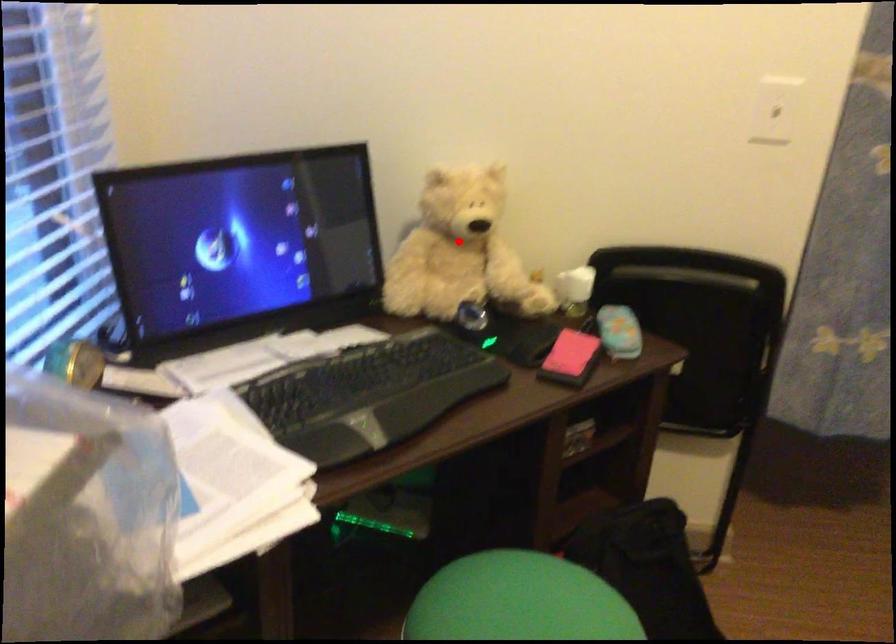
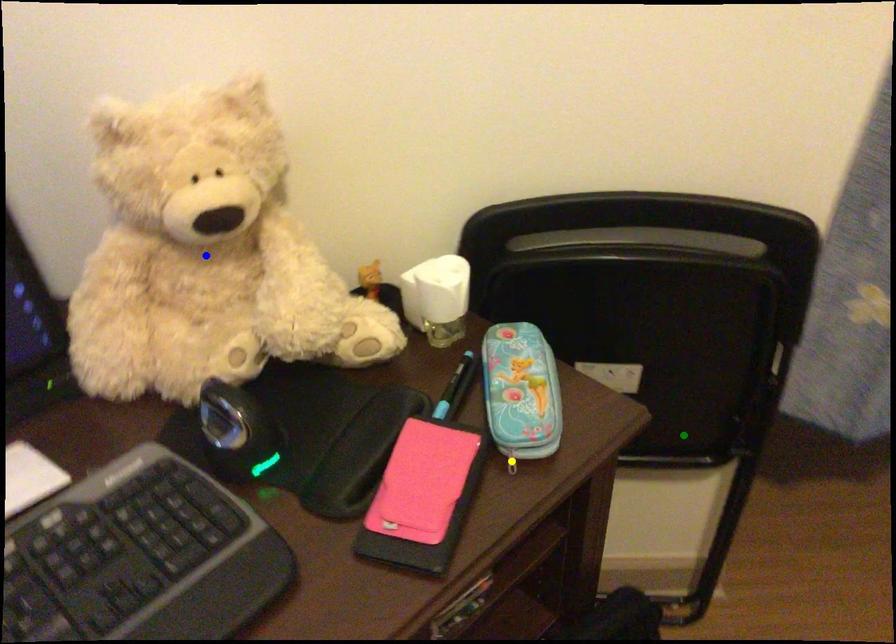
Question: I am providing you with two images of the same scene from different viewpoints. A red point is marked on the first image. You are given multiple points on the second image. Can you choose the point in image 2 that corresponds to the point in image 1?

Choices:
 (A) green point
 (B) yellow point
 (C) blue point

Answer: (C)